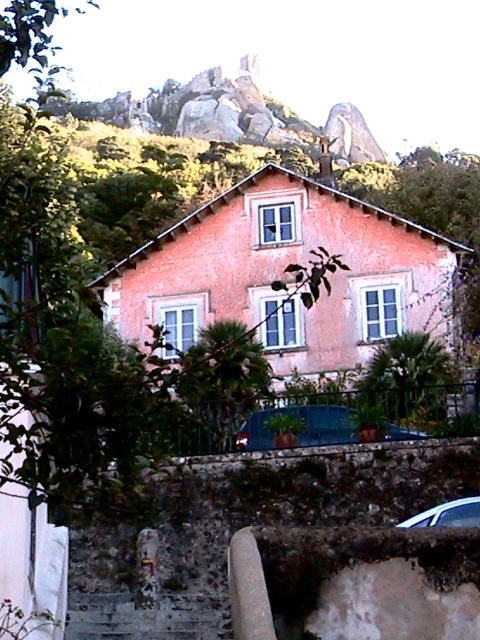
You are a delivery person trying to park your van between the metallic blue car at lower center and the satin silver car at lower right. The van is 6 meters long. Can you fit it in the space between them?

The metallic blue car at lower center is smaller than the satin silver car at lower right. However, the exact distance between them isn

You are a delivery driver who needs to park your truck between the metallic blue car at lower center and the satin silver car at lower right. The truck is 20 feet long. Can you fit your truck between them without moving either car?

The metallic blue car at lower center is 44.07 feet away from the satin silver car at lower right. Since the truck is 20 feet long, there is sufficient space between them to park the truck without moving either car.

You are a delivery person approaching the house and need to park your vehicle. You see a metallic blue car at lower center and a satin silver car at lower right. Which car is blocking the driveway entrance?

The metallic blue car at lower center is positioned over the satin silver car at lower right, meaning it is closer to the driveway entrance and thus blocking it.